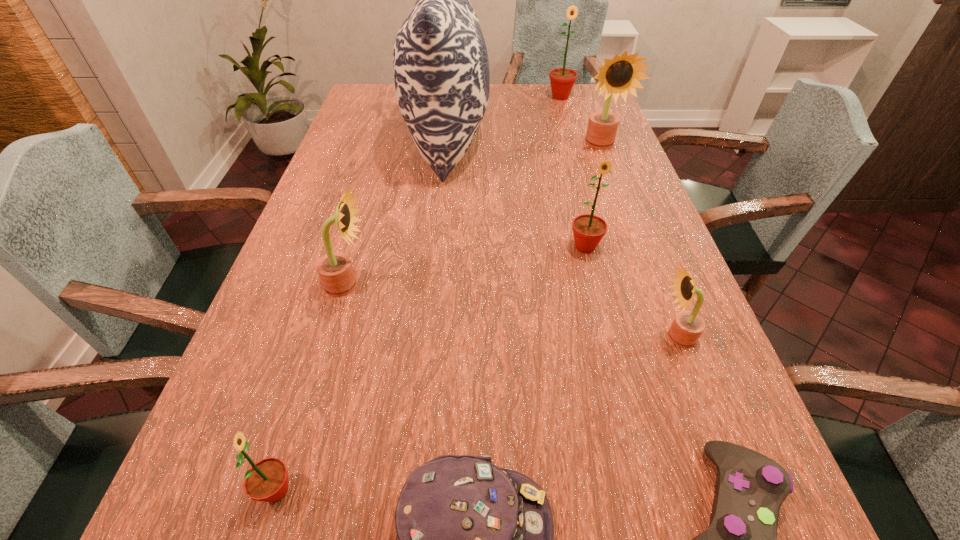
Image resolution: width=960 pixels, height=540 pixels. What are the coordinates of `the fourth nearest object` in the screenshot? It's located at (687, 327).

In order to click on the nearest yellow sunflower in this screenshot , I will do `click(687, 327)`.

Identify the location of the nearest sunflower. (267, 480).

Where is `the leftmost green sunflower`? The height and width of the screenshot is (540, 960). the leftmost green sunflower is located at coordinates (267, 480).

At what (x,y) coordinates should I click in order to perform the action: click on free region located on the front surface of the blue cushion. Please return your answer as a coordinate pair (x, y). Looking at the image, I should click on (564, 143).

This screenshot has width=960, height=540. In order to click on free location located 0.200m on the face of the biggest yellow sunflower in this screenshot , I will do `click(619, 197)`.

Locate an element on the screen. This screenshot has width=960, height=540. vacant area located 0.280m on the face of the biggest green sunflower is located at coordinates (574, 143).

This screenshot has height=540, width=960. Identify the location of vacant area situated on the face of the second farthest yellow sunflower. tap(520, 285).

The image size is (960, 540). Find the location of `vacant space located on the face of the sixth nearest object`. vacant space located on the face of the sixth nearest object is located at coordinates (597, 298).

Where is `free spot located 0.240m on the face of the nearest yellow sunflower`? The width and height of the screenshot is (960, 540). free spot located 0.240m on the face of the nearest yellow sunflower is located at coordinates (532, 337).